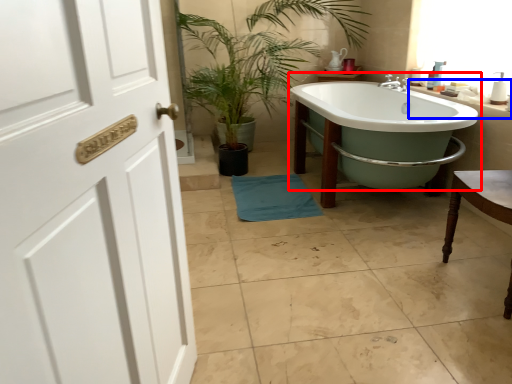
Question: Which of the following is the closest to the observer, bathtub (highlighted by a red box) or counter top (highlighted by a blue box)?

Choices:
 (A) bathtub
 (B) counter top

Answer: (A)